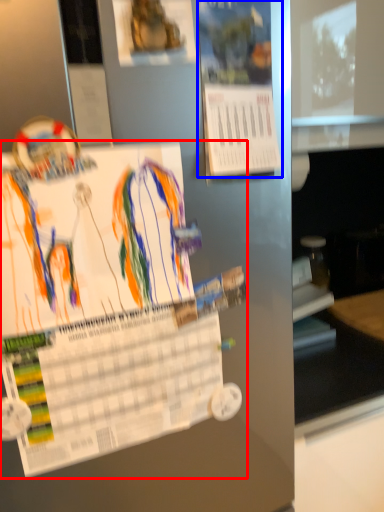
Question: Which of the following is the closest to the observer, poster (highlighted by a red box) or poster (highlighted by a blue box)?

Choices:
 (A) poster
 (B) poster

Answer: (A)